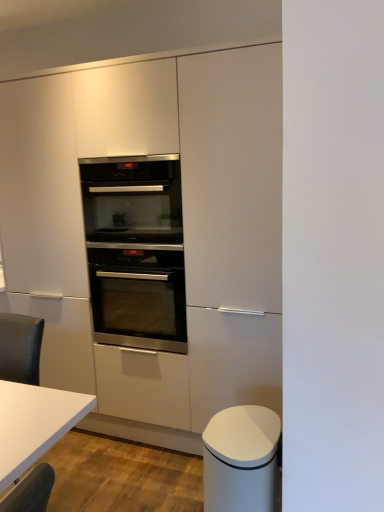
Question: Looking at the image, does satin white cabinet at center, the 2th cabinetry viewed from the front, seem bigger or smaller compared to white matte trash can at lower right, marked as the 2th cabinetry in a back-to-front arrangement?

Choices:
 (A) big
 (B) small

Answer: (A)

Question: From a real-world perspective, is satin white cabinet at center, the first cabinetry when ordered from back to front, positioned above or below white matte trash can at lower right, the first cabinetry from the front?

Choices:
 (A) below
 (B) above

Answer: (B)

Question: Which object is positioned closest to the satin white cabinet at center, the first cabinetry when ordered from back to front?

Choices:
 (A) stainless steel oven at center, acting as the second oven starting from the top
 (B) white glossy table at lower left
 (C) stainless steel oven at center, which ranks as the second oven in bottom-to-top order
 (D) white matte trash can at lower right, the first cabinetry from the front

Answer: (A)

Question: Which of these objects is positioned farthest from the stainless steel oven at center, which ranks as the second oven in bottom-to-top order?

Choices:
 (A) white matte trash can at lower right, marked as the 2th cabinetry in a back-to-front arrangement
 (B) stainless steel oven at center, positioned as the 1th oven in bottom-to-top order
 (C) white glossy table at lower left
 (D) satin white cabinet at center, the first cabinetry when ordered from back to front

Answer: (C)